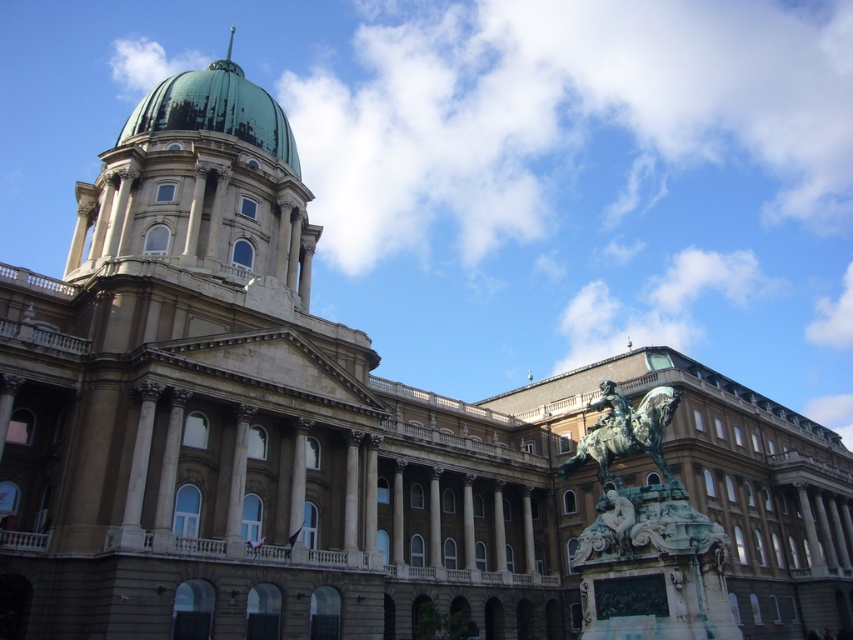
You are standing at the entrance of the grand building and notice two points marked on the facade. The first point is located at coordinates point [151,108] and the second at point [229,54]. From your vantage point, which point appears closer to you?

Point [151,108] is in front of point [229,54], so it appears closer to you.